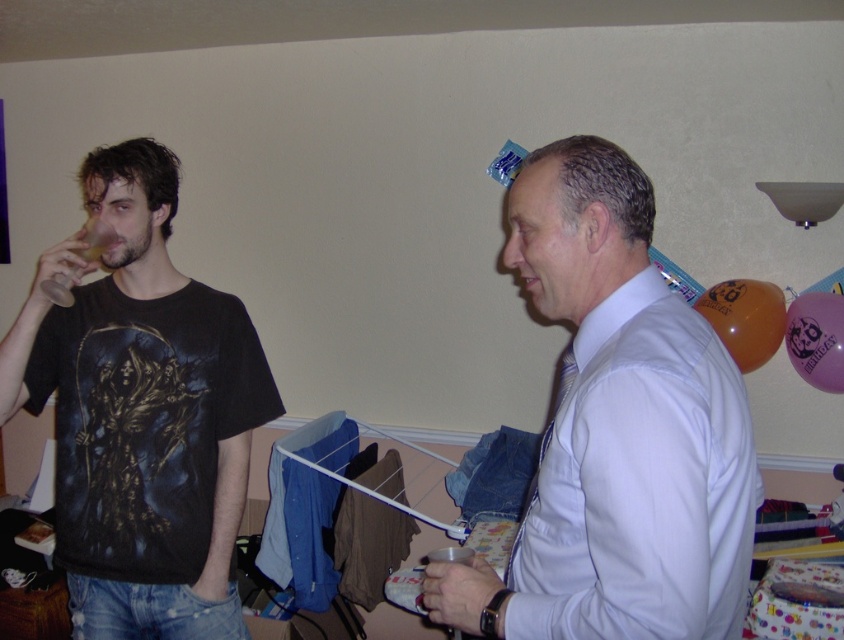
Question: Which object is closer to the camera taking this photo?

Choices:
 (A) translucent orange balloon at upper right
 (B) white glossy shirt at center

Answer: (B)

Question: Considering the real-world distances, which object is farthest from the black matte t-shirt at left?

Choices:
 (A) pink latex balloon at upper right
 (B) translucent orange balloon at upper right

Answer: (A)

Question: Which point is closer to the camera?

Choices:
 (A) pink latex balloon at upper right
 (B) white glossy shirt at center
 (C) black matte t-shirt at left

Answer: (B)

Question: Considering the relative positions of white glossy shirt at center and black matte t-shirt at left in the image provided, where is white glossy shirt at center located with respect to black matte t-shirt at left?

Choices:
 (A) right
 (B) left

Answer: (A)

Question: Is black matte t-shirt at left above pink latex balloon at upper right?

Choices:
 (A) no
 (B) yes

Answer: (A)

Question: Is translucent orange balloon at upper right thinner than pink latex balloon at upper right?

Choices:
 (A) yes
 (B) no

Answer: (B)